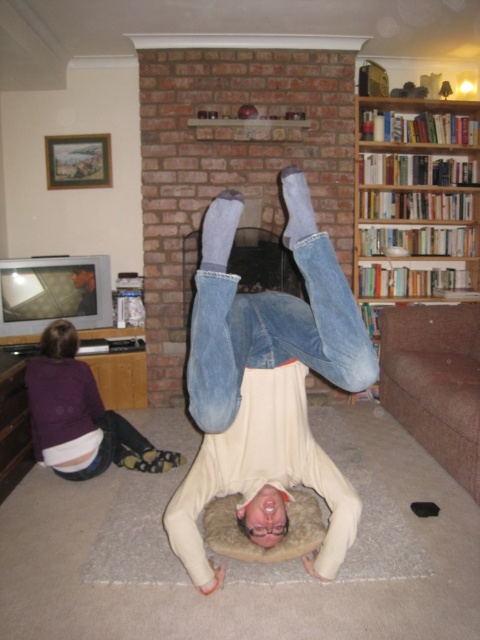
Question: Is wooden bookshelf at right below purple fleece sweater at lower left?

Choices:
 (A) yes
 (B) no

Answer: (B)

Question: Can you confirm if wooden bookshelf at right is positioned above smooth plastic remote at lower left?

Choices:
 (A) yes
 (B) no

Answer: (A)

Question: Which of the following is the farthest from the observer?

Choices:
 (A) (83, 307)
 (B) (372, 285)

Answer: (B)

Question: Which point is farther to the camera?

Choices:
 (A) wooden bookshelf at right
 (B) matte gray television at lower left

Answer: (A)

Question: Among these points, which one is nearest to the camera?

Choices:
 (A) (409, 189)
 (B) (105, 452)
 (C) (101, 282)
 (D) (344, 353)

Answer: (D)

Question: Can you confirm if purple fleece sweater at lower left is positioned to the right of matte gray television at lower left?

Choices:
 (A) no
 (B) yes

Answer: (B)